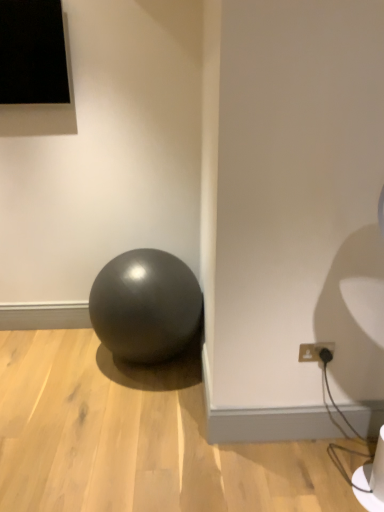
Question: Considering the relative positions of matte black ball at center and matte black outlet at lower right in the image provided, is matte black ball at center behind matte black outlet at lower right?

Choices:
 (A) no
 (B) yes

Answer: (B)

Question: Is matte black ball at center outside matte black outlet at lower right?

Choices:
 (A) yes
 (B) no

Answer: (A)

Question: Is matte black ball at center positioned before matte black outlet at lower right?

Choices:
 (A) no
 (B) yes

Answer: (A)

Question: Can you confirm if matte black ball at center is bigger than matte black outlet at lower right?

Choices:
 (A) yes
 (B) no

Answer: (A)

Question: From a real-world perspective, is matte black ball at center over matte black outlet at lower right?

Choices:
 (A) no
 (B) yes

Answer: (A)

Question: Considering the relative sizes of matte black ball at center and matte black outlet at lower right in the image provided, is matte black ball at center thinner than matte black outlet at lower right?

Choices:
 (A) yes
 (B) no

Answer: (B)

Question: From the image's perspective, is matte black outlet at lower right located beneath matte black ball at center?

Choices:
 (A) yes
 (B) no

Answer: (A)

Question: Is matte black outlet at lower right bigger than matte black ball at center?

Choices:
 (A) no
 (B) yes

Answer: (A)

Question: Considering the relative sizes of matte black outlet at lower right and matte black ball at center in the image provided, is matte black outlet at lower right shorter than matte black ball at center?

Choices:
 (A) yes
 (B) no

Answer: (A)

Question: From a real-world perspective, is matte black outlet at lower right positioned over matte black ball at center based on gravity?

Choices:
 (A) yes
 (B) no

Answer: (A)

Question: Is matte black outlet at lower right positioned with its back to matte black ball at center?

Choices:
 (A) no
 (B) yes

Answer: (A)

Question: Does matte black outlet at lower right have a greater width compared to matte black ball at center?

Choices:
 (A) no
 (B) yes

Answer: (A)

Question: Would you say matte black ball at center is to the left or to the right of matte black outlet at lower right in the picture?

Choices:
 (A) right
 (B) left

Answer: (B)